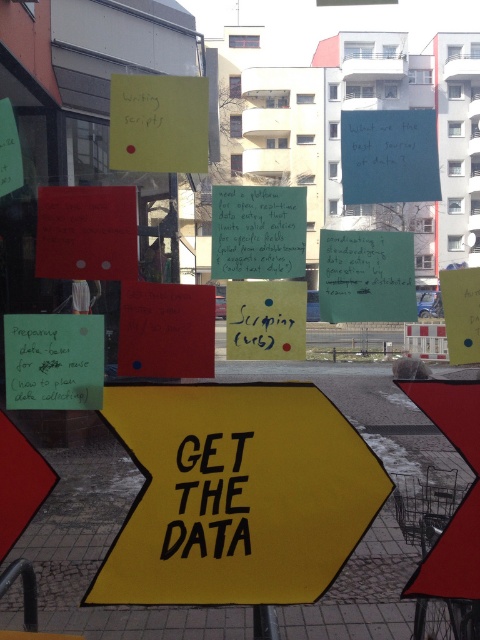
Question: Which object is farther from the camera taking this photo?

Choices:
 (A) yellow matte arrow at center
 (B) metallic pole at lower center
 (C) black paper at center
 (D) green paper note at lower left

Answer: (B)

Question: Which of the following is the closest to the observer?

Choices:
 (A) green matte paper at center
 (B) yellow matte arrow at center
 (C) green paper note at lower left
 (D) black paper at center

Answer: (C)

Question: Is green matte paper at center bigger than metallic pole at lower center?

Choices:
 (A) no
 (B) yes

Answer: (A)

Question: Considering the real-world distances, which object is closest to the green matte paper at center?

Choices:
 (A) yellow matte arrow at center
 (B) green paper note at lower left

Answer: (B)

Question: Is green paper note at lower left to the left of metallic pole at lower center from the viewer's perspective?

Choices:
 (A) yes
 (B) no

Answer: (A)

Question: Is green matte paper at center further to camera compared to metallic pole at lower center?

Choices:
 (A) no
 (B) yes

Answer: (B)